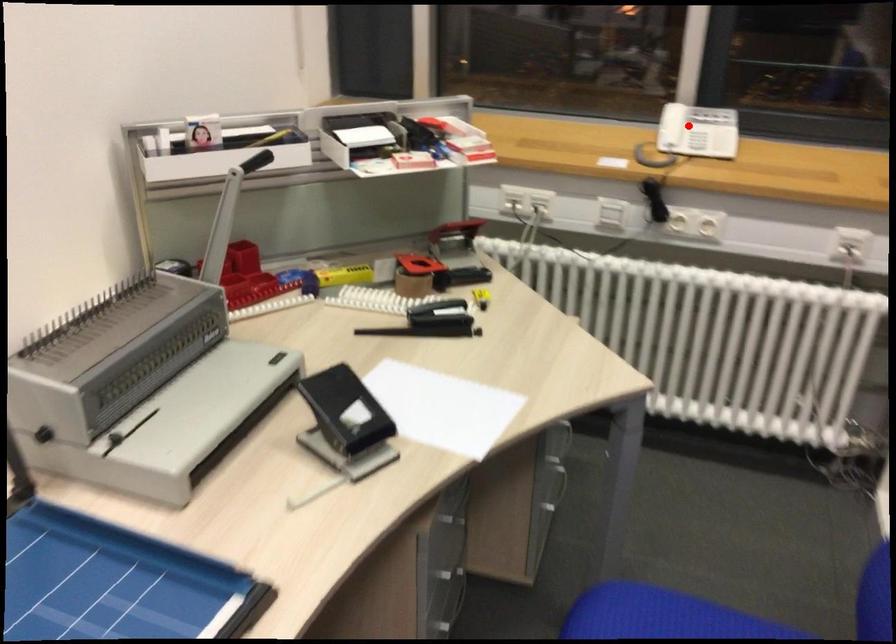
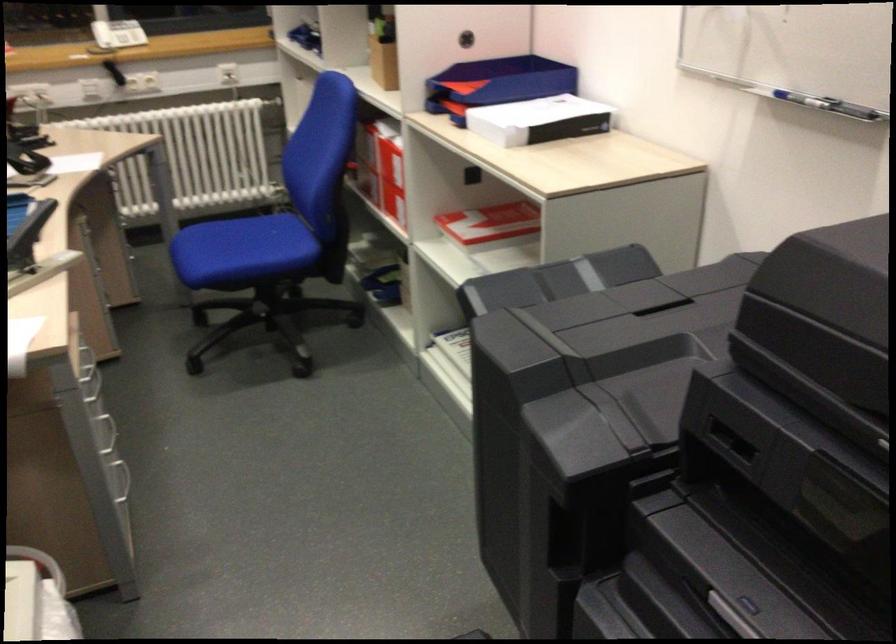
Question: I am providing you with two images of the same scene from different viewpoints. In image1, a red point is highlighted. Considering the same 3D point in image2, which of the following is correct?

Choices:
 (A) It is closer
 (B) It is farther

Answer: (B)